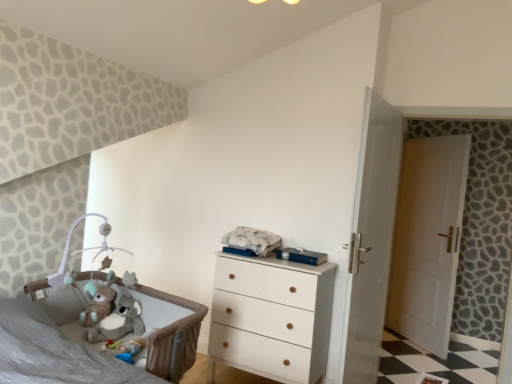
Question: Based on their sizes in the image, would you say fluffy plush koala at lower left is bigger or smaller than white wooden door at right?

Choices:
 (A) small
 (B) big

Answer: (A)

Question: Is fluffy plush koala at lower left spatially inside white wooden door at right, or outside of it?

Choices:
 (A) outside
 (B) inside

Answer: (A)

Question: Considering the real-world distances, which object is farthest from the white wooden door at right?

Choices:
 (A) soft gray fabric infant bed at lower left
 (B) white glossy door at center
 (C) fluffy plush koala at lower left
 (D) white wood chest of drawers at center

Answer: (C)

Question: Estimate the real-world distances between objects in this image. Which object is farther from the white wooden door at right?

Choices:
 (A) white glossy door at center
 (B) white wood chest of drawers at center
 (C) fluffy plush koala at lower left
 (D) soft gray fabric infant bed at lower left

Answer: (C)